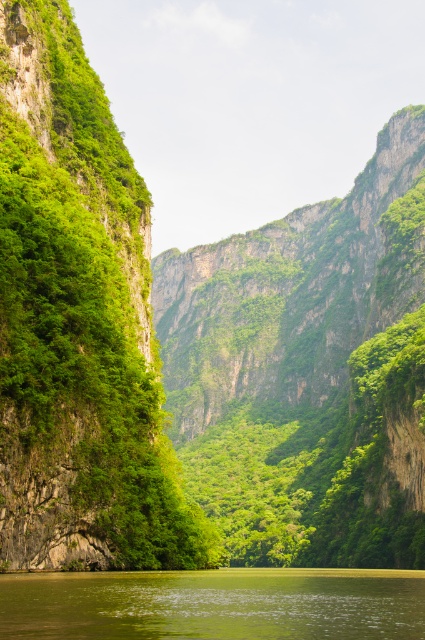
Based on the photo, you are a hiker standing on the cliff edge. You see the green leafy vegetation at left and the green liquid water at center. Which object is higher in elevation?

The green leafy vegetation at left is positioned over green liquid water at center, so it is higher in elevation.

From the picture: You are a hiker standing at the edge of the cliff. You see the green leafy vegetation at left and the green liquid water at center. Which one is closer to you?

The green leafy vegetation at left is closer to you because it is in front of the green liquid water at center.

You are a hiker trying to cross the water to reach the cliffs. The green leafy vegetation at left and the green liquid water at center are in your path. Which object is taller, making it harder to navigate around?

The green leafy vegetation at left is taller than the green liquid water at center, making it harder to navigate around.